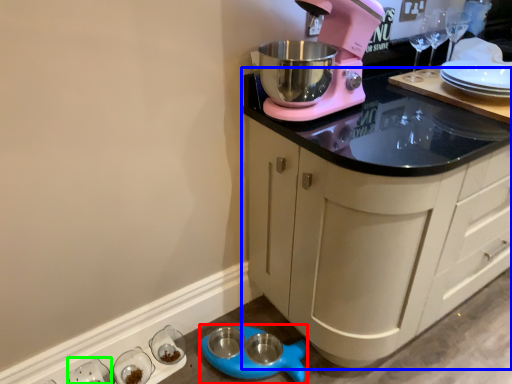
Question: Which object is the closest to the appliance (highlighted by a red box)? Choose among these: cabinetry (highlighted by a blue box) or tableware (highlighted by a green box).

Choices:
 (A) cabinetry
 (B) tableware

Answer: (B)